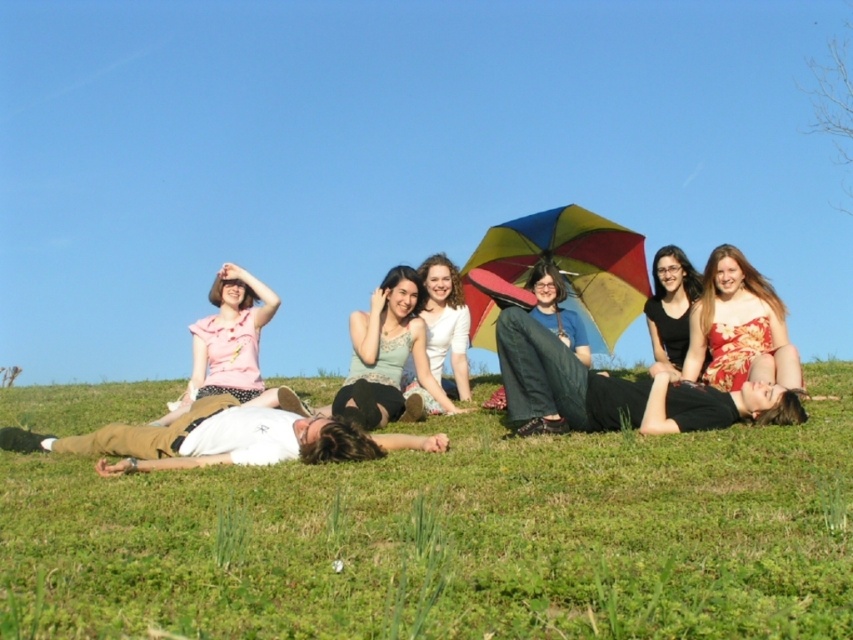
Question: Can you confirm if green grass at lower center is positioned above matte green dress at center?

Choices:
 (A) yes
 (B) no

Answer: (B)

Question: Which object is the farthest from the matte pink blouse at left?

Choices:
 (A) green grass at lower center
 (B) black matte dress at center

Answer: (A)

Question: Based on their relative distances, which object is nearer to the black matte dress at center?

Choices:
 (A) blue cotton shirt at center
 (B) white cotton shirt at center

Answer: (A)

Question: Is white cotton shirt at center positioned behind blue cotton shirt at center?

Choices:
 (A) yes
 (B) no

Answer: (B)

Question: Is matte green dress at center to the left of blue cotton shirt at center from the viewer's perspective?

Choices:
 (A) no
 (B) yes

Answer: (B)

Question: Among these points, which one is farthest from the camera?

Choices:
 (A) (782, 317)
 (B) (233, 317)
 (C) (572, 269)
 (D) (358, 340)

Answer: (C)